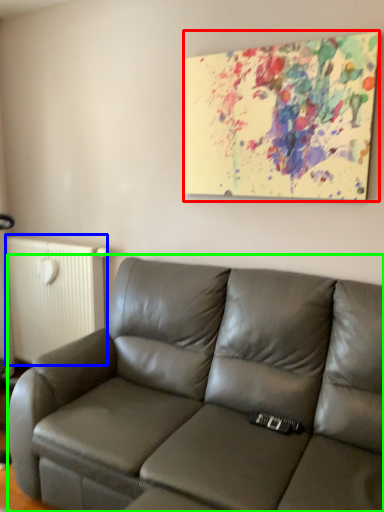
Question: Which object is positioned closest to picture frame (highlighted by a red box)? Select from radiator (highlighted by a blue box) and studio couch (highlighted by a green box).

Choices:
 (A) radiator
 (B) studio couch

Answer: (B)